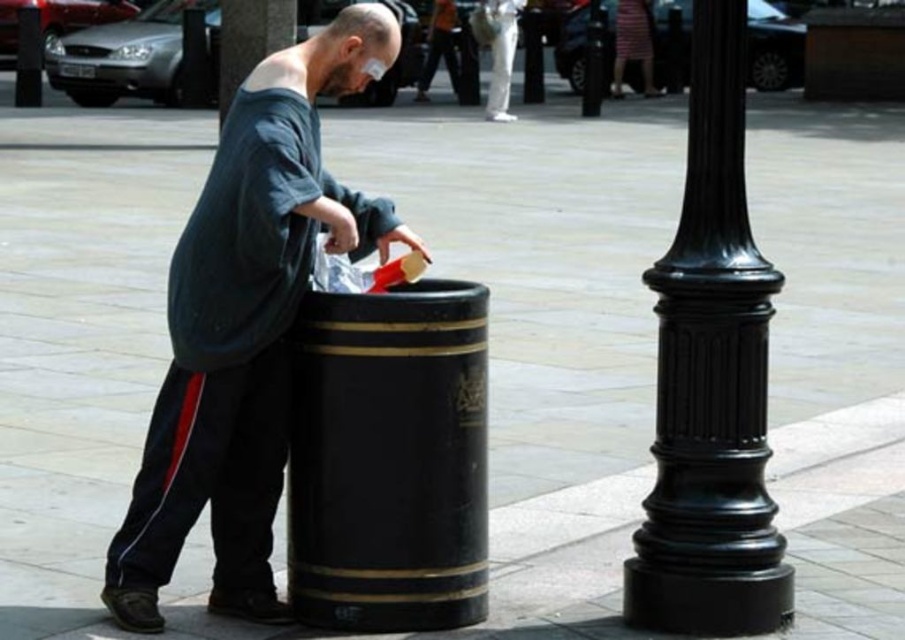
Does matte black trash can at center have a lesser width compared to black polished barrel at center?

In fact, matte black trash can at center might be wider than black polished barrel at center.

Is matte black trash can at center further to the viewer compared to black polished barrel at center?

That is False.

Which is in front, point (306, 65) or point (418, 627)?

Point (306, 65) is more forward.

This screenshot has height=640, width=905. Identify the location of matte black trash can at center. (246, 324).

Can you confirm if matte black trash can at center is thinner than black polished pole at center?

No, matte black trash can at center is not thinner than black polished pole at center.

Can you confirm if matte black trash can at center is positioned below black polished pole at center?

Yes, matte black trash can at center is below black polished pole at center.

Which is in front, point (198, 384) or point (246, 17)?

Point (198, 384)

Image resolution: width=905 pixels, height=640 pixels. In order to click on matte black trash can at center in this screenshot , I will do `click(246, 324)`.

Based on the photo, between matte black trash can at center and glossy black pole at right, which one is positioned lower?

glossy black pole at right is lower down.

Is matte black trash can at center further to camera compared to glossy black pole at right?

No.

Measure the distance between point (256, 225) and camera.

They are 22.96 feet apart.

The image size is (905, 640). In order to click on matte black trash can at center in this screenshot , I will do `click(246, 324)`.